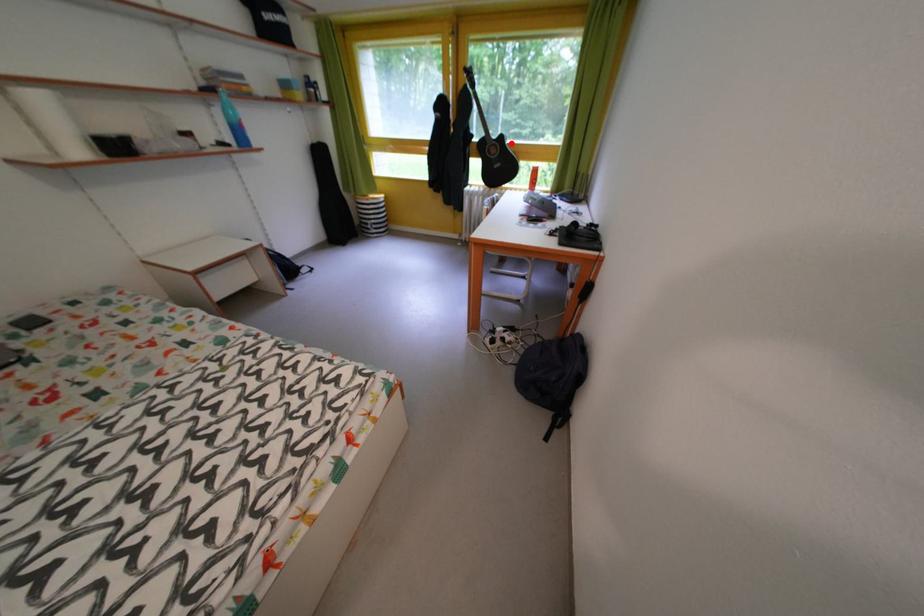
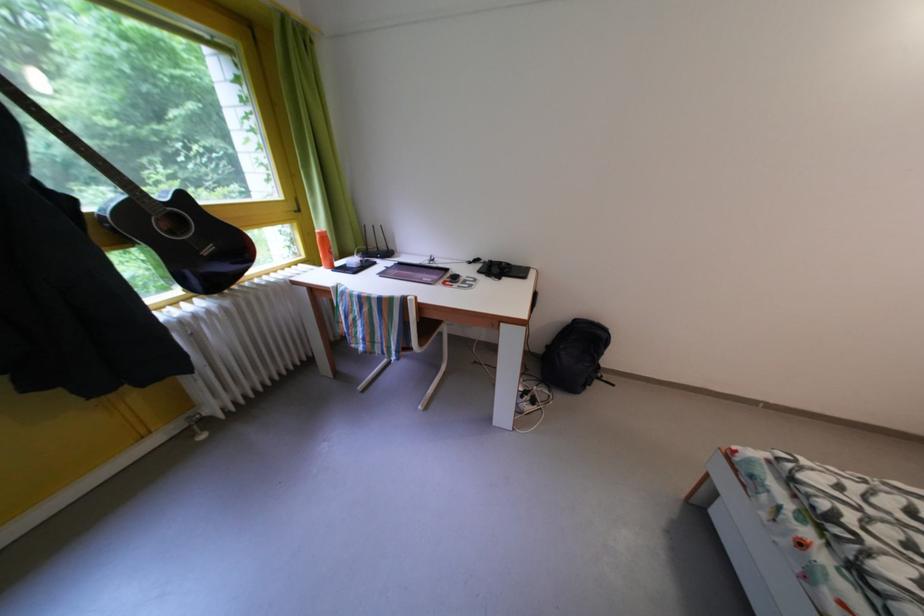
In the second image, find the point that corresponds to the highlighted location in the first image.

(191, 203)